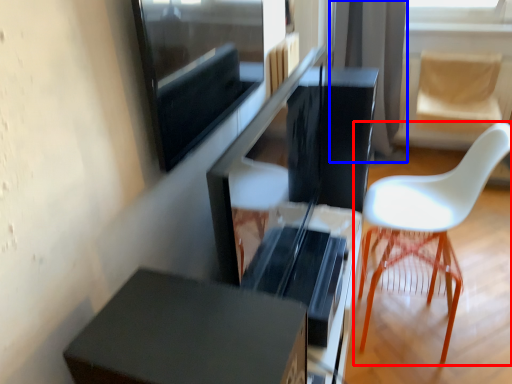
Question: Among these objects, which one is farthest to the camera, chair (highlighted by a red box) or curtain (highlighted by a blue box)?

Choices:
 (A) chair
 (B) curtain

Answer: (B)